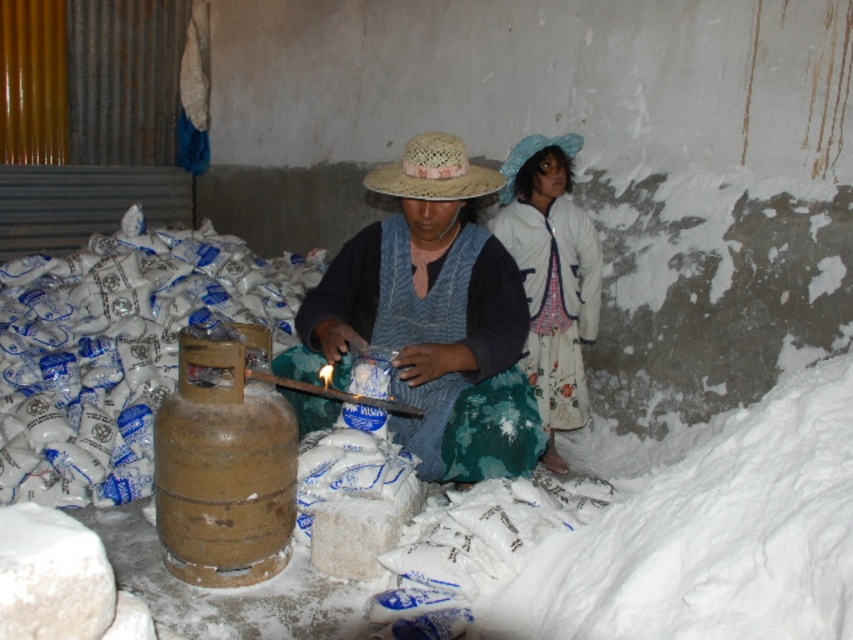
You are organizing a fashion show and need to display the white cotton dress at upper right and the straw hat at center. Which item has a greater width?

The white cotton dress at upper right has a greater width than the straw hat at center.

You are an interior designer planning to place a decorative item between the knitted straw hat at center and the white cotton dress at upper right. Which object should you place closer to the narrower one to maintain balance?

The white cotton dress at upper right is narrower than the knitted straw hat at center. To maintain balance, place the decorative item closer to the white cotton dress at upper right.